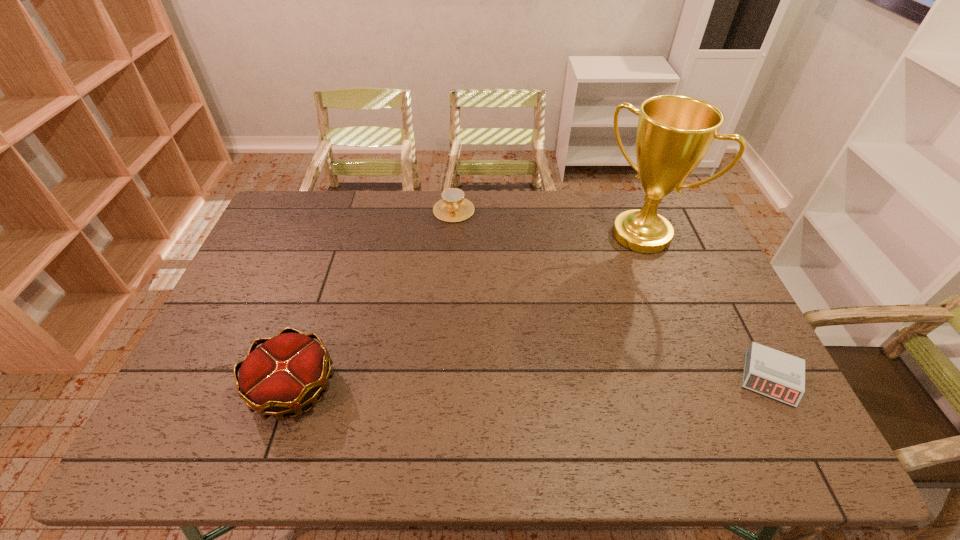
At what (x,y) coordinates should I click in order to perform the action: click on the leftmost object. Please return your answer as a coordinate pair (x, y). Looking at the image, I should click on (288, 371).

This screenshot has width=960, height=540. Find the location of `the third shortest object`. the third shortest object is located at coordinates (288, 371).

I want to click on alarm clock, so tap(778, 375).

Locate an element on the screen. This screenshot has height=540, width=960. the tallest object is located at coordinates (674, 133).

Where is `cup`? cup is located at coordinates (453, 207).

Find the location of a particular element. Image resolution: width=960 pixels, height=540 pixels. the third tallest object is located at coordinates (453, 207).

Identify the location of vacant space located 0.050m on the back of the leftmost object. This screenshot has height=540, width=960. (310, 337).

At what (x,y) coordinates should I click in order to perform the action: click on free spot located 0.350m on the back of the alarm clock. Please return your answer as a coordinate pair (x, y). Looking at the image, I should click on (708, 261).

Where is `blank space located by the handles of the tallest object`? The width and height of the screenshot is (960, 540). blank space located by the handles of the tallest object is located at coordinates (584, 300).

You are a GUI agent. You are given a task and a screenshot of the screen. Output one action in this format:
    pyautogui.click(x=<x>, y=<y>)
    Task: Click on the vacant position located by the handles of the tallest object
    Image resolution: width=960 pixels, height=540 pixels.
    Given the screenshot: What is the action you would take?
    pyautogui.click(x=612, y=263)